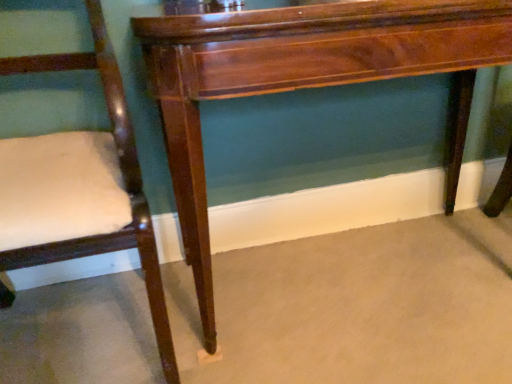
Question: Looking at their shapes, would you say mahogany wood table at center is wider or thinner than matte wood chair at left?

Choices:
 (A) thin
 (B) wide

Answer: (A)

Question: Is mahogany wood table at center in front of or behind matte wood chair at left in the image?

Choices:
 (A) front
 (B) behind

Answer: (B)

Question: Considering the positions of mahogany wood table at center and matte wood chair at left in the image, is mahogany wood table at center bigger or smaller than matte wood chair at left?

Choices:
 (A) big
 (B) small

Answer: (A)

Question: Relative to mahogany wood table at center, is matte wood chair at left in front or behind?

Choices:
 (A) front
 (B) behind

Answer: (A)

Question: Considering the positions of matte wood chair at left and mahogany wood table at center in the image, is matte wood chair at left wider or thinner than mahogany wood table at center?

Choices:
 (A) thin
 (B) wide

Answer: (B)

Question: Considering the relative positions of matte wood chair at left and mahogany wood table at center in the image provided, is matte wood chair at left to the left or to the right of mahogany wood table at center?

Choices:
 (A) right
 (B) left

Answer: (B)

Question: Considering the positions of matte wood chair at left and mahogany wood table at center in the image, is matte wood chair at left bigger or smaller than mahogany wood table at center?

Choices:
 (A) big
 (B) small

Answer: (B)